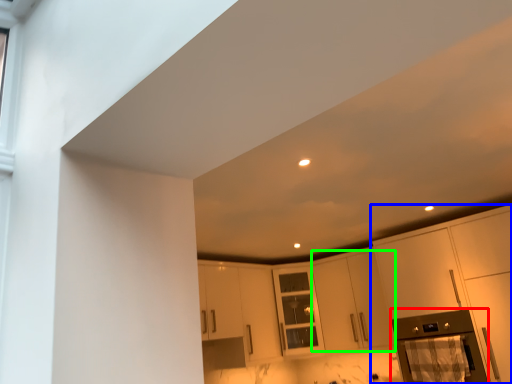
Question: Which is nearer to the appliance (highlighted by a red box)? cabinetry (highlighted by a blue box) or cabinetry (highlighted by a green box).

Choices:
 (A) cabinetry
 (B) cabinetry

Answer: (A)